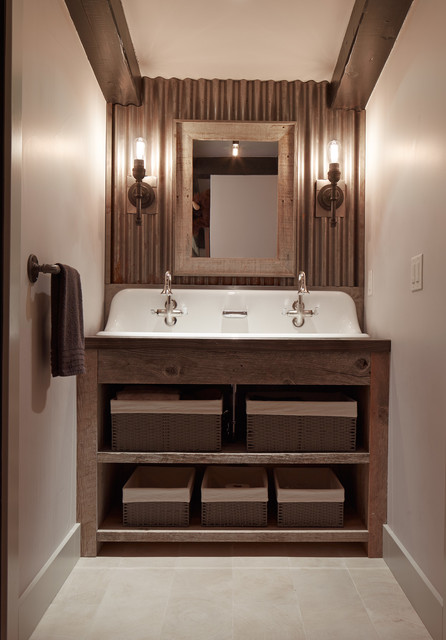
Find the location of a particular element. towel is located at coordinates (76, 317).